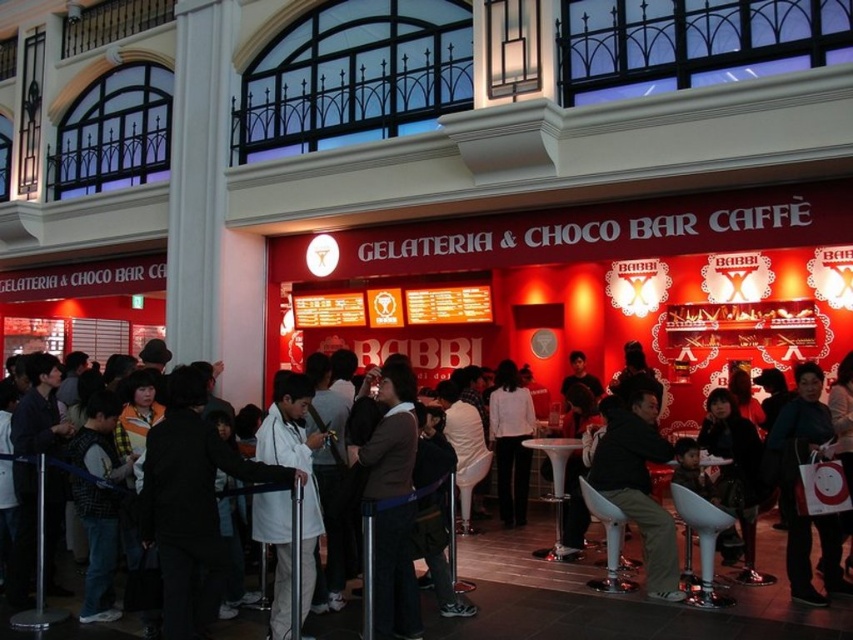
Question: Can you confirm if white coat at center is wider than brown sweater at center?

Choices:
 (A) no
 (B) yes

Answer: (B)

Question: Which of these objects is positioned farthest from the dark brown leather jacket at center?

Choices:
 (A) white matte coat at center
 (B) brown sweater at center
 (C) white paper bag at lower right

Answer: (A)

Question: Which point is farther to the camera?

Choices:
 (A) (775, 634)
 (B) (383, 384)
 (C) (259, 452)
 (D) (648, 477)

Answer: (D)

Question: Is white coat at center bigger than white paper bag at lower right?

Choices:
 (A) no
 (B) yes

Answer: (B)

Question: Which point appears closest to the camera in this image?

Choices:
 (A) (608, 600)
 (B) (419, 625)

Answer: (B)

Question: In this image, where is white coat at center located relative to white matte coat at center?

Choices:
 (A) above
 (B) below

Answer: (B)